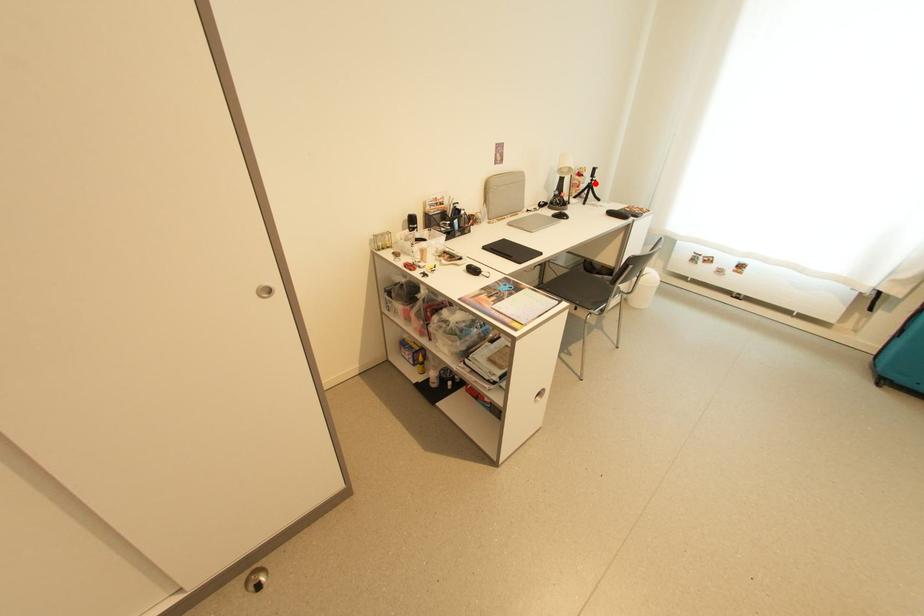
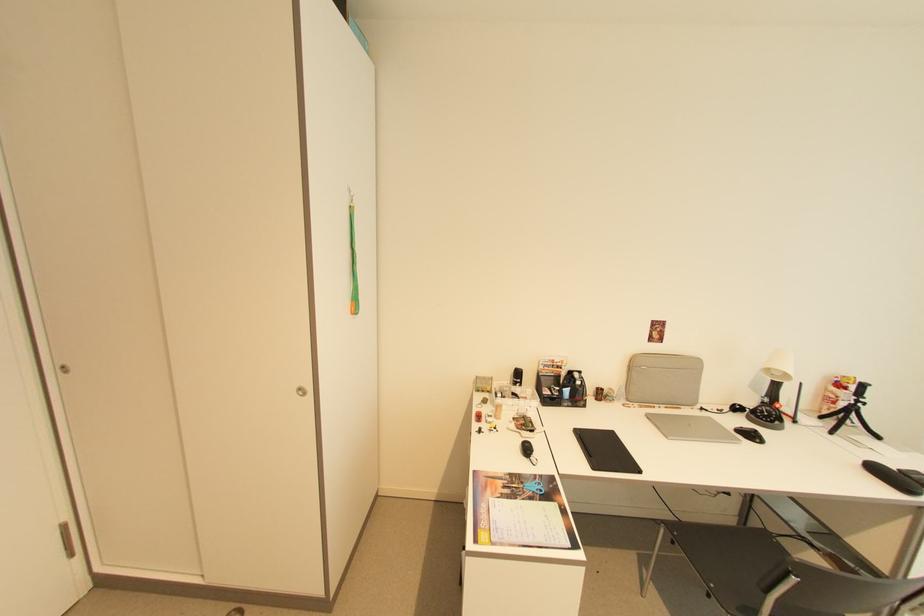
Question: I am providing you with two images of the same scene from different viewpoints. Image1 has a red point marked. In image2, the corresponding 3D location appears at what relative position? Reply with the corresponding letter.

Choices:
 (A) Closer
 (B) Farther

Answer: (A)